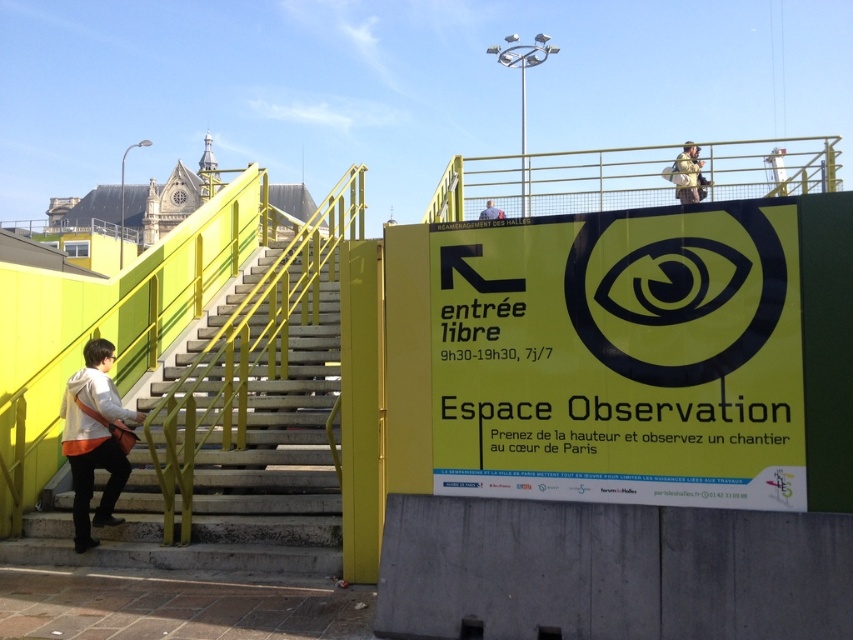
Based on the photo, who is taller, yellow metal stairs at left or yellow metal railing at upper center?

With more height is yellow metal railing at upper center.

Is yellow metal stairs at left bigger than yellow metal railing at upper center?

No, yellow metal stairs at left is not bigger than yellow metal railing at upper center.

Does point (144, 497) come in front of point (544, 170)?

Yes, point (144, 497) is closer to viewer.

Image resolution: width=853 pixels, height=640 pixels. In order to click on yellow metal stairs at left in this screenshot , I will do `click(230, 484)`.

Can you confirm if yellow metal railing at upper center is positioned above matte blue shirt at upper center?

Yes.

Describe the element at coordinates (554, 182) in the screenshot. I see `yellow metal railing at upper center` at that location.

Is point (578, 209) closer to viewer compared to point (485, 209)?

No, (578, 209) is behind (485, 209).

This screenshot has width=853, height=640. In order to click on yellow metal railing at upper center in this screenshot , I will do `click(554, 182)`.

In the scene shown: How distant is yellow matte sign at center from matte blue shirt at upper center?

yellow matte sign at center and matte blue shirt at upper center are 11.23 meters apart from each other.

Is yellow matte sign at center taller than matte blue shirt at upper center?

Yes, yellow matte sign at center is taller than matte blue shirt at upper center.

You are a GUI agent. You are given a task and a screenshot of the screen. Output one action in this format:
    pyautogui.click(x=<x>, y=<y>)
    Task: Click on the yellow matte sign at center
    The image size is (853, 640).
    Given the screenshot: What is the action you would take?
    coord(621,356)

Locate an element on the screen. yellow matte sign at center is located at coordinates (621, 356).